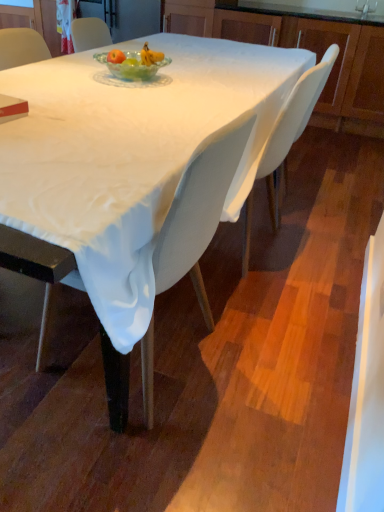
Question: Is translucent glass bowl at center facing away from matte wood cabinet at upper right?

Choices:
 (A) yes
 (B) no

Answer: (A)

Question: Is translucent glass bowl at center located outside matte wood cabinet at upper right?

Choices:
 (A) yes
 (B) no

Answer: (A)

Question: Does translucent glass bowl at center have a larger size compared to matte wood cabinet at upper right?

Choices:
 (A) yes
 (B) no

Answer: (B)

Question: From the image's perspective, is translucent glass bowl at center below matte wood cabinet at upper right?

Choices:
 (A) no
 (B) yes

Answer: (B)

Question: Can you confirm if translucent glass bowl at center is taller than matte wood cabinet at upper right?

Choices:
 (A) yes
 (B) no

Answer: (B)

Question: Is matte wood cabinet at upper right a part of translucent glass bowl at center?

Choices:
 (A) yes
 (B) no

Answer: (B)

Question: Considering the relative sizes of matte red book at lower left and silver metallic faucet at upper center in the image provided, is matte red book at lower left wider than silver metallic faucet at upper center?

Choices:
 (A) no
 (B) yes

Answer: (B)

Question: Considering the relative positions of matte red book at lower left and silver metallic faucet at upper center in the image provided, is matte red book at lower left behind silver metallic faucet at upper center?

Choices:
 (A) yes
 (B) no

Answer: (B)

Question: Is matte red book at lower left facing away from silver metallic faucet at upper center?

Choices:
 (A) no
 (B) yes

Answer: (B)

Question: Is matte red book at lower left positioned beyond the bounds of silver metallic faucet at upper center?

Choices:
 (A) yes
 (B) no

Answer: (A)

Question: Would you say matte red book at lower left contains silver metallic faucet at upper center?

Choices:
 (A) yes
 (B) no

Answer: (B)

Question: Considering the relative sizes of matte red book at lower left and silver metallic faucet at upper center in the image provided, is matte red book at lower left taller than silver metallic faucet at upper center?

Choices:
 (A) no
 (B) yes

Answer: (A)

Question: From a real-world perspective, is matte red book at lower left located higher than matte wood cabinet at upper right?

Choices:
 (A) yes
 (B) no

Answer: (A)